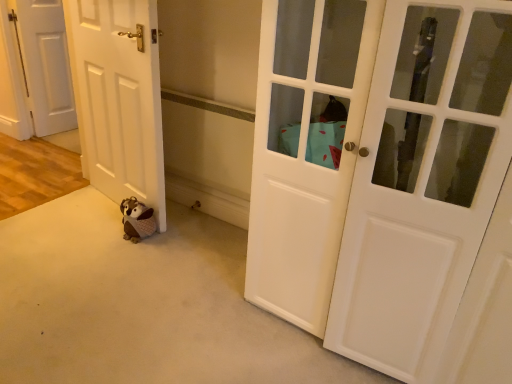
In order to click on vacant region above white matte door at left, the first door when ordered from back to front (from a real-world perspective) in this screenshot , I will do `click(32, 0)`.